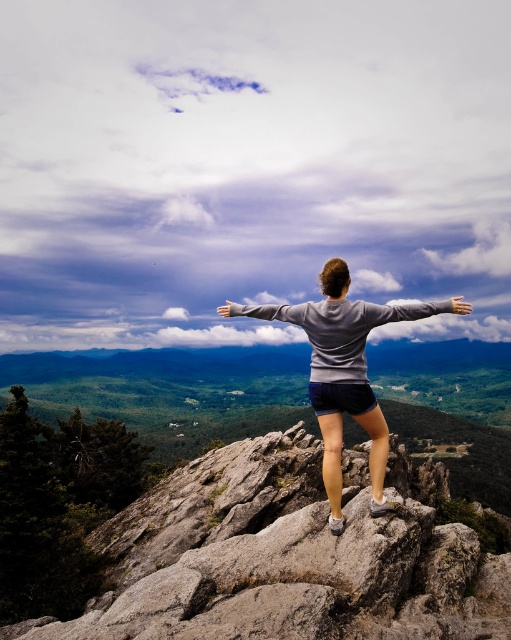
Can you confirm if gray sweatshirt at center is thinner than white matte hand at upper center?

Indeed, gray sweatshirt at center has a lesser width compared to white matte hand at upper center.

Who is taller, gray sweatshirt at center or white matte hand at upper center?

With more height is white matte hand at upper center.

Is point (230, 305) positioned after point (456, 308)?

Yes, it is behind point (456, 308).

Locate an element on the screen. The image size is (511, 640). gray sweatshirt at center is located at coordinates (262, 310).

Identify the location of gray matte sweatshirt at center. The image size is (511, 640). (342, 385).

Between gray matte sweatshirt at center and gray matte hand at center, which one appears on the right side from the viewer's perspective?

gray matte sweatshirt at center is more to the right.

The height and width of the screenshot is (640, 511). Find the location of `gray matte sweatshirt at center`. gray matte sweatshirt at center is located at coordinates (342, 385).

This screenshot has height=640, width=511. I want to click on gray matte sweatshirt at center, so click(342, 385).

Is point (321, 333) less distant than point (447, 305)?

Yes, it is in front of point (447, 305).

From the picture: Is gray matte sweatshirt at center thinner than gray sweatshirt at upper center?

Yes, gray matte sweatshirt at center is thinner than gray sweatshirt at upper center.

Image resolution: width=511 pixels, height=640 pixels. Describe the element at coordinates (342, 385) in the screenshot. I see `gray matte sweatshirt at center` at that location.

Image resolution: width=511 pixels, height=640 pixels. In order to click on gray matte sweatshirt at center in this screenshot , I will do `click(342, 385)`.